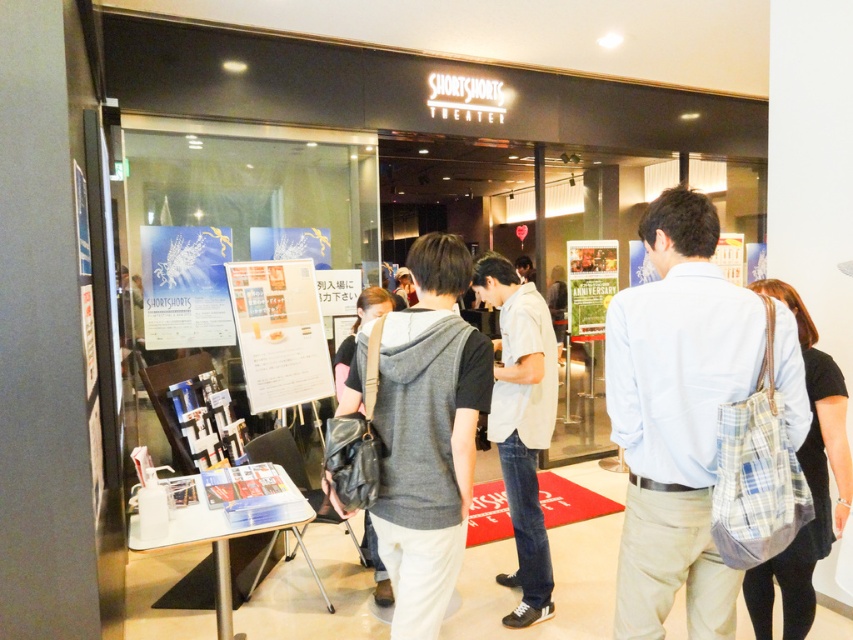
You are standing at the entrance of SHORTSHORTS THEATER and see both the light blue shirt at center and the matte black backpack at center. Which object is positioned lower from the ground?

The light blue shirt at center is below matte black backpack at center, so the light blue shirt at center is positioned lower from the ground.

You are standing at the entrance of SHORTSHORTS THEATER and want to read both the matte white paper poster at left and the green paper poster at center. Which poster should you move closer to first to read both without moving past the other?

You should move closer to the matte white paper poster at left first because it is in front of the green paper poster at center. Once you step back, you can then view the green paper poster at center behind it.

You are a visitor at the SHORTSHORTS THEATER entrance and notice both the light beige cotton shirt at center and the white paper poster at center. Which object is wider?

The light beige cotton shirt at center is narrower than the white paper poster at center, so the white paper poster at center is wider.